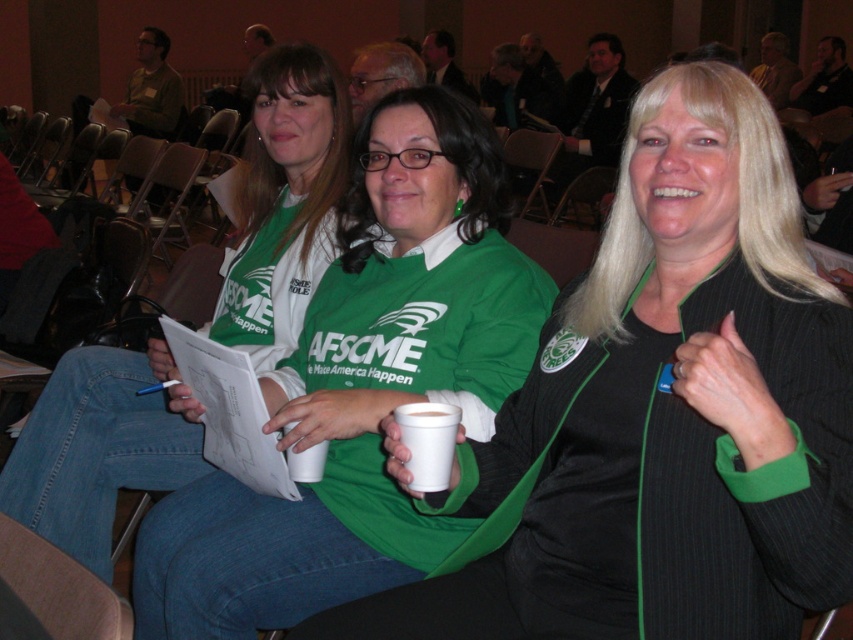
You are standing in the conference room and need to find the green matte shirt at center. According to the coordinates provided, where should you look to locate it?

The green matte shirt at center is located at point 0.606 on the x axis and 0.426 on the y axis.